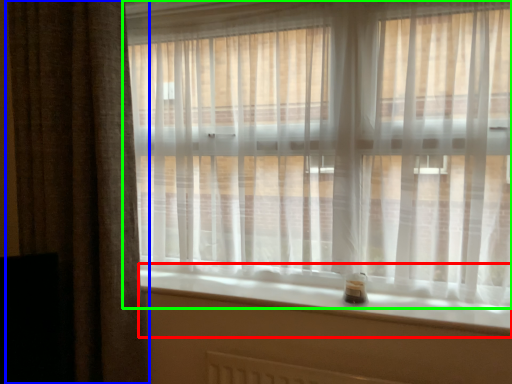
Question: Which object is positioned farthest from window sill (highlighted by a red box)? Select from curtain (highlighted by a blue box) and curtain (highlighted by a green box).

Choices:
 (A) curtain
 (B) curtain

Answer: (A)